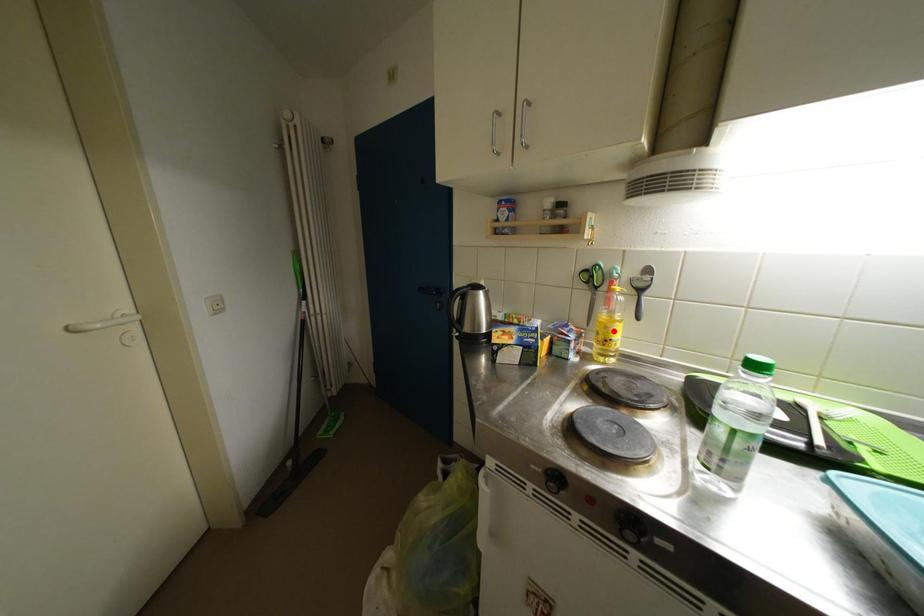
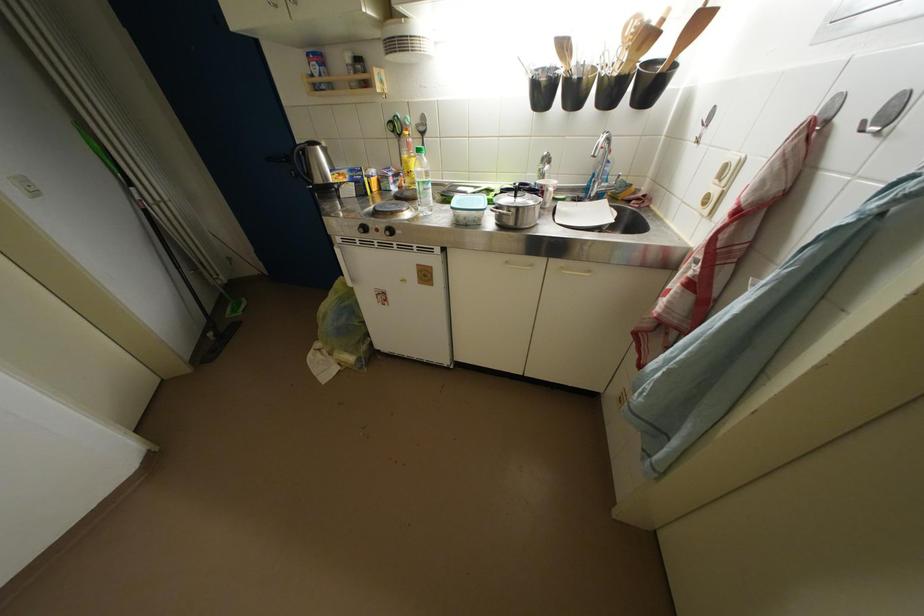
In the second image, find the point that corresponds to the highlighted location in the first image.

(412, 167)